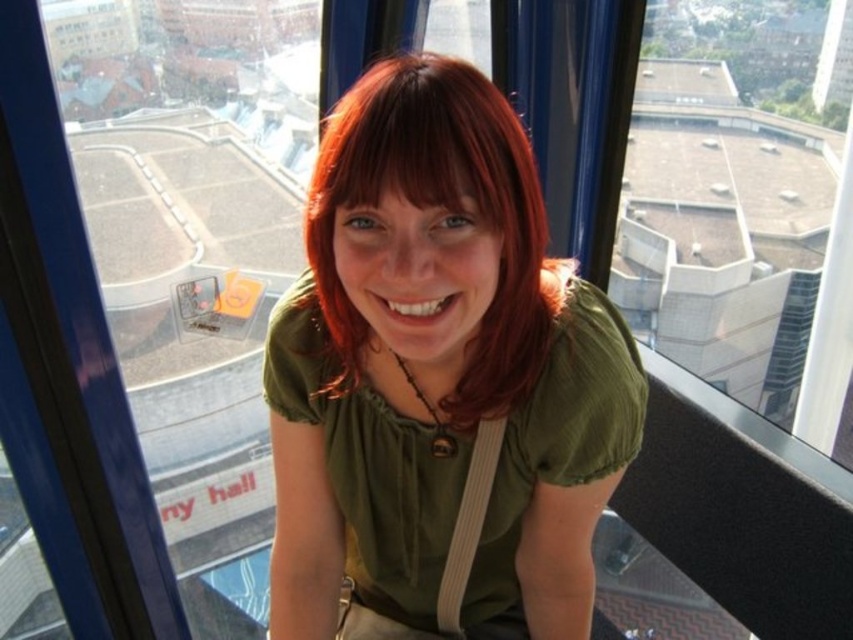
Question: Considering the relative positions of matte green shirt at center and shiny red hair at center in the image provided, where is matte green shirt at center located with respect to shiny red hair at center?

Choices:
 (A) right
 (B) left

Answer: (A)

Question: Is matte green shirt at center behind shiny red hair at center?

Choices:
 (A) yes
 (B) no

Answer: (B)

Question: Which object is farther from the camera taking this photo?

Choices:
 (A) shiny red hair at center
 (B) matte green shirt at center

Answer: (A)

Question: Is the position of matte green shirt at center less distant than that of shiny red hair at center?

Choices:
 (A) no
 (B) yes

Answer: (B)